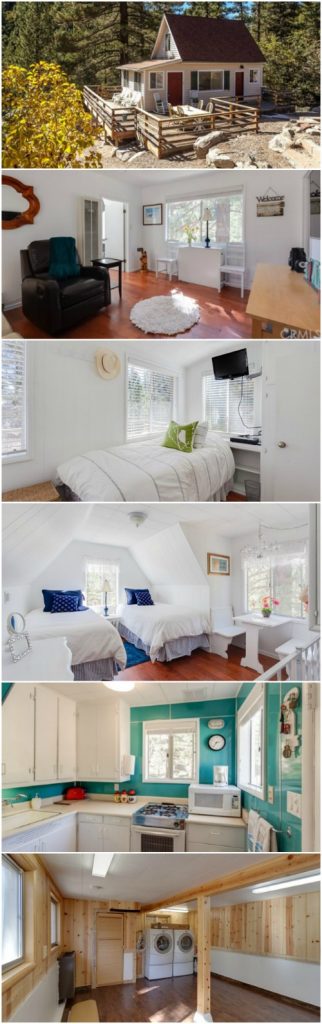
The width and height of the screenshot is (322, 1024). In order to click on chair legs second image in this screenshot , I will do `click(164, 265)`, `click(176, 267)`, `click(171, 272)`, `click(156, 271)`, `click(225, 276)`, `click(220, 278)`, `click(243, 289)`.